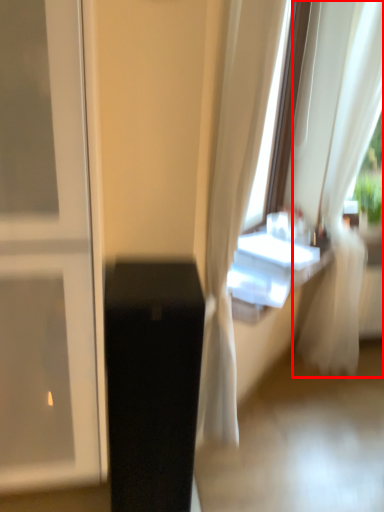
Question: From the image's perspective, what is the correct spatial relationship of curtain (annotated by the red box) in relation to furniture?

Choices:
 (A) below
 (B) above

Answer: (B)